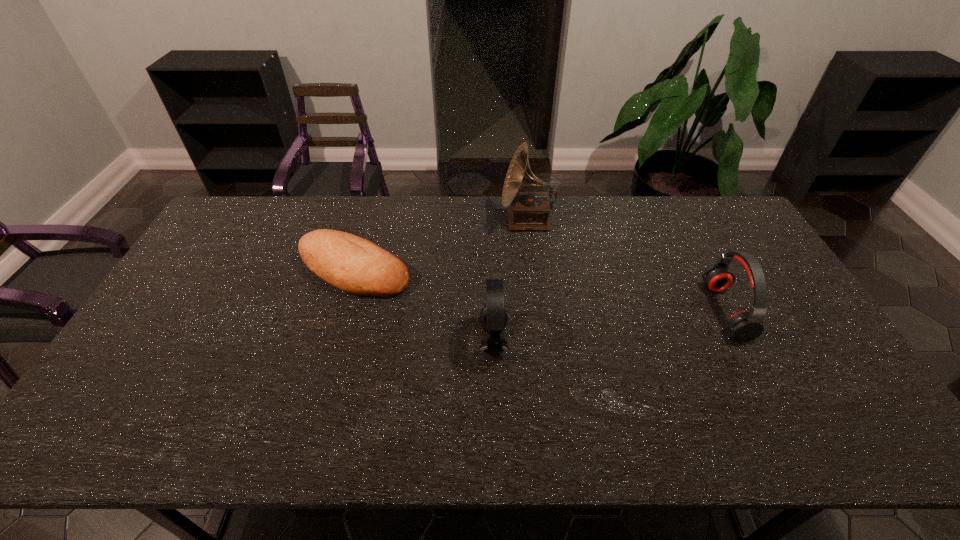
Find the location of a particular element. The image size is (960, 540). vacant area that lies between the bread and the left earphone is located at coordinates (423, 306).

Find the location of a particular element. The height and width of the screenshot is (540, 960). free space between the shortest object and the left earphone is located at coordinates tap(423, 306).

Point out which object is positioned as the nearest to the left earphone. Please provide its 2D coordinates. Your answer should be formatted as a tuple, i.e. [(x, y)], where the tuple contains the x and y coordinates of a point satisfying the conditions above.

[(354, 265)]

Choose which object is the third nearest neighbor to the left earphone. Please provide its 2D coordinates. Your answer should be formatted as a tuple, i.e. [(x, y)], where the tuple contains the x and y coordinates of a point satisfying the conditions above.

[(744, 326)]